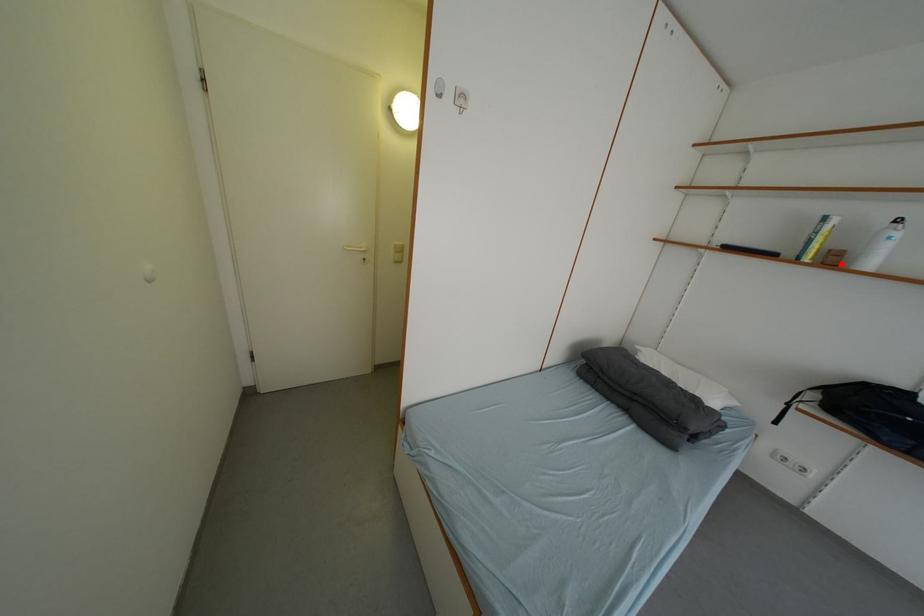
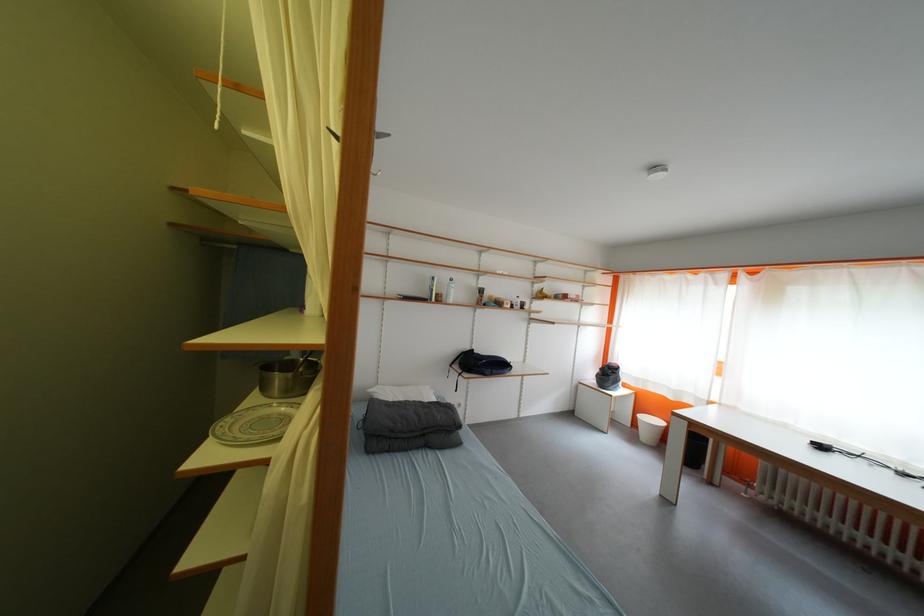
Find the pixel in the second image that matches the highlighted location in the first image.

(447, 302)